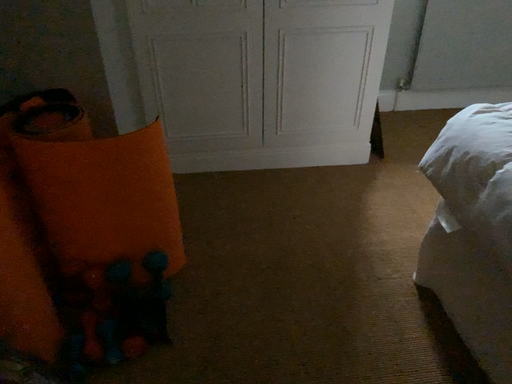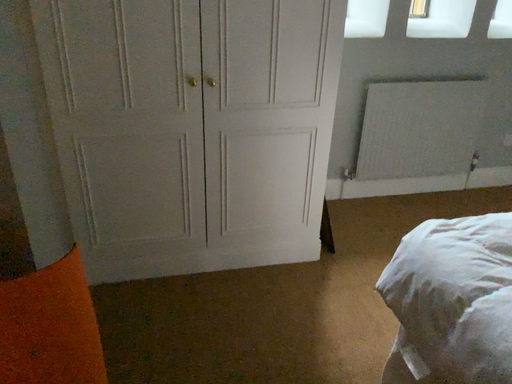
Question: How did the camera likely rotate when shooting the video?

Choices:
 (A) rotated downward
 (B) rotated upward

Answer: (B)